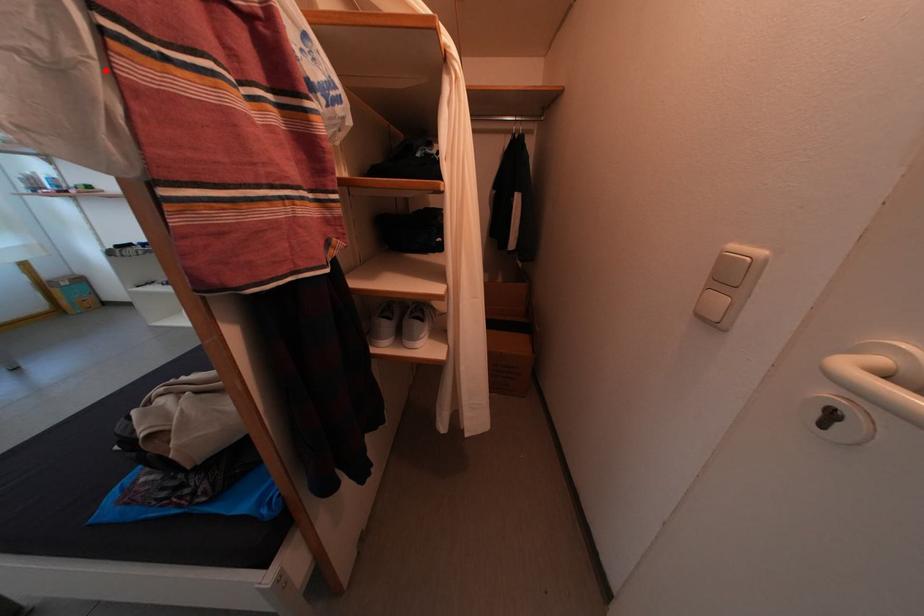
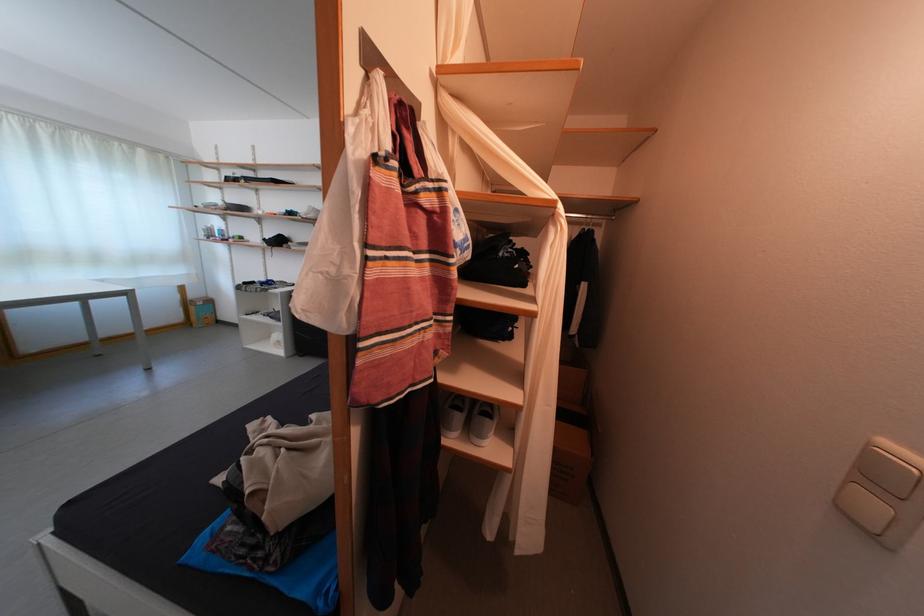
In the second image, find the point that corresponds to the highlighted location in the first image.

(366, 282)